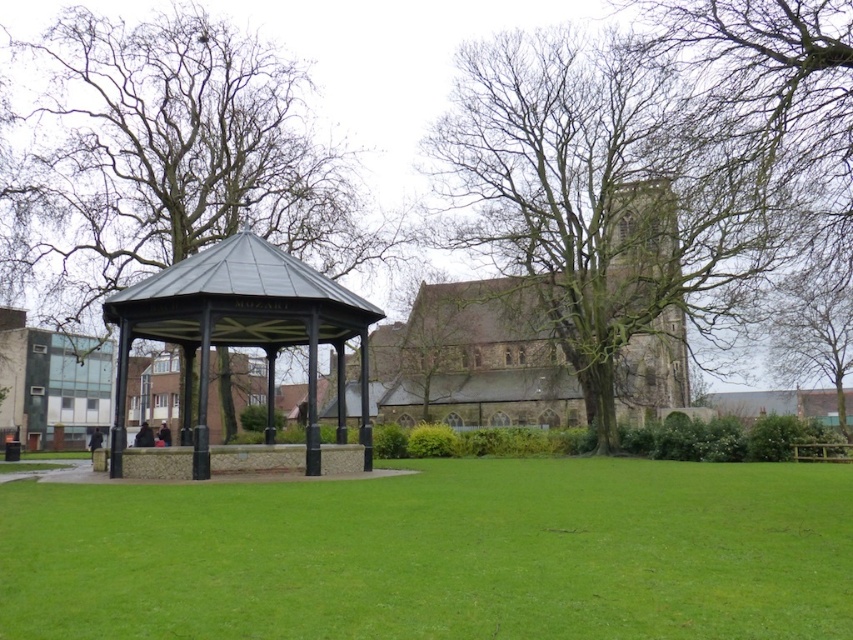
Question: Which of the following is the closest to the observer?

Choices:
 (A) metallic gazebo at center
 (B) black metal gazebo at center

Answer: (B)

Question: Is green grass at center to the right of green leafy tree at upper right from the viewer's perspective?

Choices:
 (A) yes
 (B) no

Answer: (B)

Question: Which of the following is the closest to the observer?

Choices:
 (A) (196, 474)
 (B) (560, 381)
 (C) (491, 624)
 (D) (137, 86)

Answer: (C)

Question: Which point appears farthest from the camera in this image?

Choices:
 (A) (749, 136)
 (B) (827, 266)
 (C) (113, 573)
 (D) (448, 326)

Answer: (D)

Question: Can you confirm if bare branches at center is positioned to the right of black metal gazebo at center?

Choices:
 (A) yes
 (B) no

Answer: (B)

Question: Does green mossy tree at upper right have a smaller size compared to green leafy tree at upper right?

Choices:
 (A) no
 (B) yes

Answer: (A)